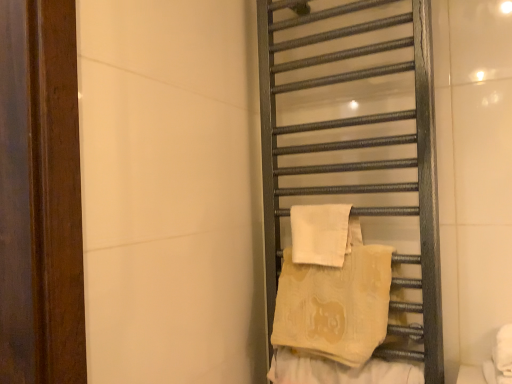
What do you see at coordinates (339, 370) in the screenshot? I see `beige textured towel at center-right` at bounding box center [339, 370].

At what (x,y) coordinates should I click in order to perform the action: click on metallic towel rack at right. Please return your answer as a coordinate pair (x, y). The image size is (512, 384). Looking at the image, I should click on (357, 152).

How distant is metallic towel rack at right from white cotton beach towel at right, the 1th beach towel viewed from the top?

metallic towel rack at right is 8.23 inches from white cotton beach towel at right, the 1th beach towel viewed from the top.

Considering the sizes of metallic towel rack at right and white cotton beach towel at right, the 1th beach towel viewed from the top, in the image, is metallic towel rack at right taller or shorter than white cotton beach towel at right, the 1th beach towel viewed from the top,?

metallic towel rack at right is taller than white cotton beach towel at right, the 1th beach towel viewed from the top.

Is metallic towel rack at right turned away from white cotton beach towel at right, the 1th beach towel viewed from the top?

Yes, metallic towel rack at right is positioned with its back facing white cotton beach towel at right, the 1th beach towel viewed from the top.

Is metallic towel rack at right thinner than white cotton beach towel at right, the 1th beach towel viewed from the top?

In fact, metallic towel rack at right might be wider than white cotton beach towel at right, the 1th beach towel viewed from the top.

How distant is white cotton beach towel at right, the 2th beach towel positioned from the bottom, from metallic towel rack at right?

white cotton beach towel at right, the 2th beach towel positioned from the bottom, is 20.91 centimeters away from metallic towel rack at right.

Between white cotton beach towel at right, the 1th beach towel viewed from the top, and metallic towel rack at right, which one has smaller width?

Thinner between the two is white cotton beach towel at right, the 1th beach towel viewed from the top.

Is white cotton beach towel at right, the 2th beach towel positioned from the bottom, to the left of metallic towel rack at right from the viewer's perspective?

Yes, white cotton beach towel at right, the 2th beach towel positioned from the bottom, is to the left of metallic towel rack at right.

In the scene shown: Is white cotton beach towel at right, the 2th beach towel positioned from the bottom, smaller than metallic towel rack at right?

Yes.

Does point (280, 311) lie in front of point (336, 223)?

No, it is behind (336, 223).

Considering the relative positions of beige cotton beach towel at center-right, marked as the first beach towel in a bottom-to-top arrangement, and white cotton beach towel at right, the 2th beach towel positioned from the bottom, in the image provided, is beige cotton beach towel at center-right, marked as the first beach towel in a bottom-to-top arrangement, to the left or to the right of white cotton beach towel at right, the 2th beach towel positioned from the bottom,?

From the image, it's evident that beige cotton beach towel at center-right, marked as the first beach towel in a bottom-to-top arrangement, is to the right of white cotton beach towel at right, the 2th beach towel positioned from the bottom.

Is beige cotton beach towel at center-right, marked as the first beach towel in a bottom-to-top arrangement, facing towards white cotton beach towel at right, the 2th beach towel positioned from the bottom?

No.

Can you tell me how much beige cotton beach towel at center-right, acting as the 2th beach towel starting from the top, and white cotton beach towel at right, the 1th beach towel viewed from the top, differ in facing direction?

The facing directions of beige cotton beach towel at center-right, acting as the 2th beach towel starting from the top, and white cotton beach towel at right, the 1th beach towel viewed from the top, are 5.24 degrees apart.

Does point (280, 305) come in front of point (362, 370)?

No, it is not.

From the image's perspective, is beige cotton beach towel at center-right, marked as the first beach towel in a bottom-to-top arrangement, over beige textured towel at center-right?

Correct, beige cotton beach towel at center-right, marked as the first beach towel in a bottom-to-top arrangement, appears higher than beige textured towel at center-right in the image.

Based on their positions, is beige cotton beach towel at center-right, acting as the 2th beach towel starting from the top, located to the left or right of beige textured towel at center-right?

From the image, it's evident that beige cotton beach towel at center-right, acting as the 2th beach towel starting from the top, is to the left of beige textured towel at center-right.

Is beige cotton beach towel at center-right, marked as the first beach towel in a bottom-to-top arrangement, located within metallic towel rack at right?

Yes, beige cotton beach towel at center-right, marked as the first beach towel in a bottom-to-top arrangement, is a part of metallic towel rack at right.

Consider the image. Is metallic towel rack at right taller than beige cotton beach towel at center-right, acting as the 2th beach towel starting from the top?

Yes.

From the image's perspective, does metallic towel rack at right appear higher than beige cotton beach towel at center-right, acting as the 2th beach towel starting from the top?

Yes, from the image's perspective, metallic towel rack at right is above beige cotton beach towel at center-right, acting as the 2th beach towel starting from the top.

From a real-world perspective, which object stands above the other?

metallic towel rack at right is physically above.

Could you tell me if beige textured towel at center-right is turned towards white cotton beach towel at right, the 2th beach towel positioned from the bottom?

No, beige textured towel at center-right does not turn towards white cotton beach towel at right, the 2th beach towel positioned from the bottom.

Between beige textured towel at center-right and white cotton beach towel at right, the 2th beach towel positioned from the bottom, which one has larger width?

Wider between the two is beige textured towel at center-right.

Identify the location of the 2nd beach towel above the beige textured towel at center-right (from the image's perspective). Image resolution: width=512 pixels, height=384 pixels. (320, 233).

From the image's perspective, which is above, beige textured towel at center-right or white cotton beach towel at right, the 2th beach towel positioned from the bottom?

white cotton beach towel at right, the 2th beach towel positioned from the bottom.

From a real-world perspective, is metallic towel rack at right on beige textured towel at center-right?

Yes, from a real-world perspective, metallic towel rack at right is above beige textured towel at center-right.

Does metallic towel rack at right lie behind beige textured towel at center-right?

Yes, it is behind beige textured towel at center-right.

Considering the positions of objects metallic towel rack at right and beige textured towel at center-right in the image provided, who is more to the right, metallic towel rack at right or beige textured towel at center-right?

Positioned to the right is metallic towel rack at right.

Would you consider metallic towel rack at right to be distant from beige textured towel at center-right?

No, there isn't a large distance between metallic towel rack at right and beige textured towel at center-right.

Identify the location of towel rack on the right of the white cotton beach towel at right, the 2th beach towel positioned from the bottom. The width and height of the screenshot is (512, 384). (357, 152).

Find the location of a particular element. The width and height of the screenshot is (512, 384). the 2nd beach towel to the left when counting from the metallic towel rack at right is located at coordinates (320, 233).

Considering their positions, is beige textured towel at center-right positioned closer to beige cotton beach towel at center-right, acting as the 2th beach towel starting from the top, than white cotton beach towel at right, the 1th beach towel viewed from the top?

The object closer to beige cotton beach towel at center-right, acting as the 2th beach towel starting from the top, is white cotton beach towel at right, the 1th beach towel viewed from the top.

From the image, which object appears to be nearer to white cotton beach towel at right, the 2th beach towel positioned from the bottom, beige cotton beach towel at center-right, acting as the 2th beach towel starting from the top, or beige textured towel at center-right?

beige cotton beach towel at center-right, acting as the 2th beach towel starting from the top, is positioned closer to the anchor white cotton beach towel at right, the 2th beach towel positioned from the bottom.

From the picture: Considering their positions, is beige textured towel at center-right positioned further to metallic towel rack at right than beige cotton beach towel at center-right, marked as the first beach towel in a bottom-to-top arrangement?

beige textured towel at center-right is further to metallic towel rack at right.

From the image, which object appears to be farther from metallic towel rack at right, white cotton beach towel at right, the 2th beach towel positioned from the bottom, or beige textured towel at center-right?

beige textured towel at center-right is further to metallic towel rack at right.

When comparing their distances from beige cotton beach towel at center-right, acting as the 2th beach towel starting from the top, does metallic towel rack at right or beige textured towel at center-right seem closer?

beige textured towel at center-right is closer to beige cotton beach towel at center-right, acting as the 2th beach towel starting from the top.

From the image, which object appears to be nearer to beige textured towel at center-right, beige cotton beach towel at center-right, acting as the 2th beach towel starting from the top, or white cotton beach towel at right, the 2th beach towel positioned from the bottom?

beige cotton beach towel at center-right, acting as the 2th beach towel starting from the top.

Based on their spatial positions, is metallic towel rack at right or white cotton beach towel at right, the 2th beach towel positioned from the bottom, closer to beige textured towel at center-right?

white cotton beach towel at right, the 2th beach towel positioned from the bottom, is closer to beige textured towel at center-right.

Based on their spatial positions, is beige textured towel at center-right or metallic towel rack at right closer to beige cotton beach towel at center-right, marked as the first beach towel in a bottom-to-top arrangement?

Among the two, beige textured towel at center-right is located nearer to beige cotton beach towel at center-right, marked as the first beach towel in a bottom-to-top arrangement.

This screenshot has width=512, height=384. I want to click on beach towel between metallic towel rack at right and beige cotton beach towel at center-right, acting as the 2th beach towel starting from the top, in the up-down direction, so click(x=320, y=233).

Image resolution: width=512 pixels, height=384 pixels. What are the coordinates of `beach towel between white cotton beach towel at right, the 1th beach towel viewed from the top, and beige textured towel at center-right from top to bottom` in the screenshot? It's located at (335, 299).